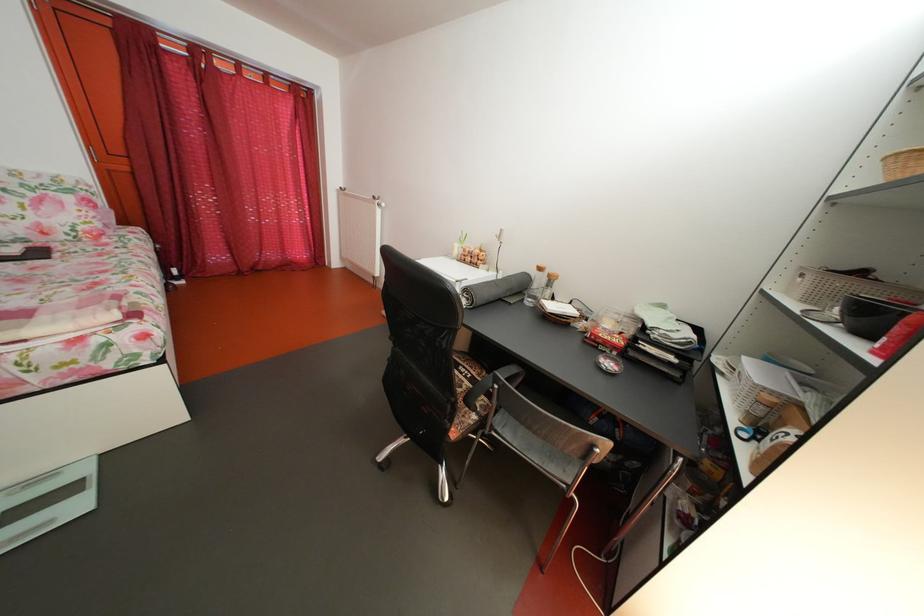
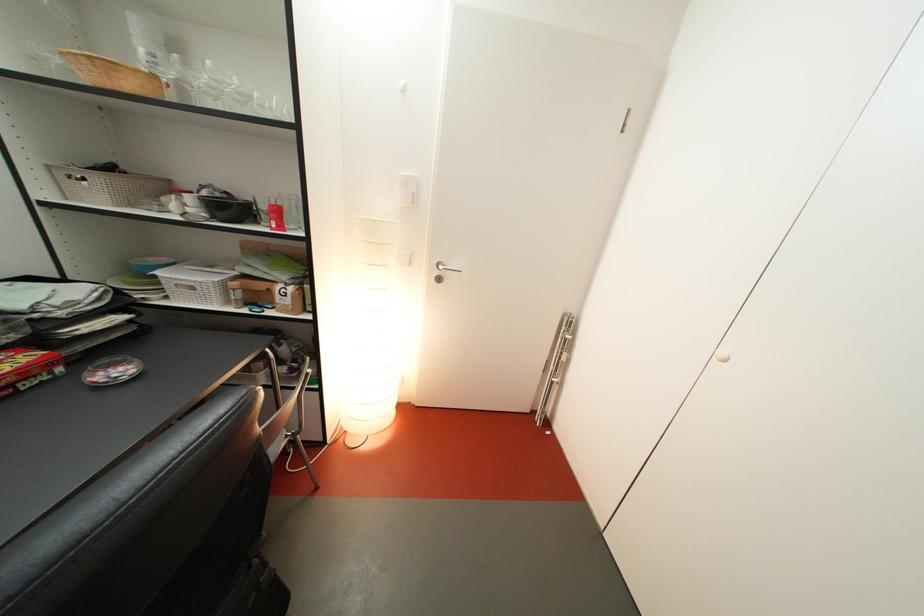
In the second image, find the point that corresponds to [624,371] in the first image.

(131, 376)